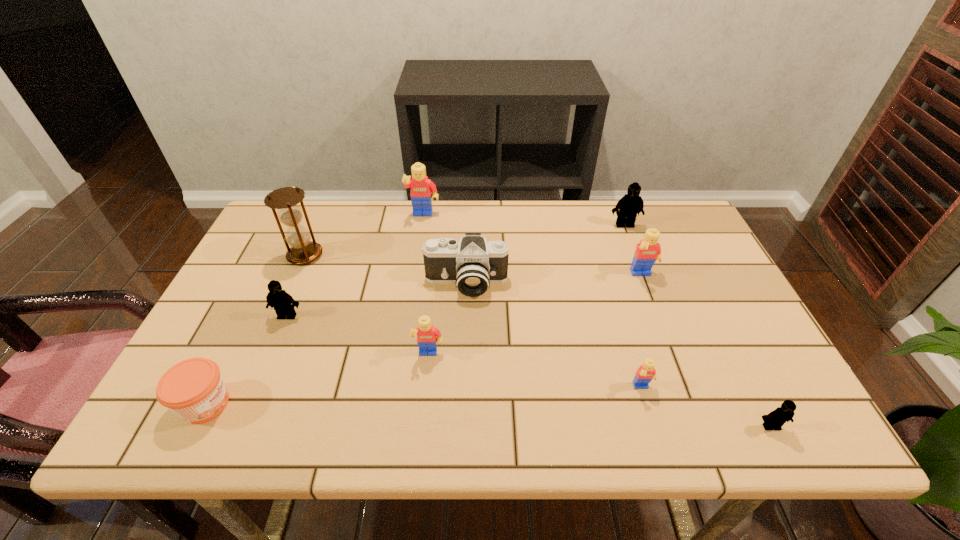
At what (x,y) coordinates should I click in order to perform the action: click on free space located on the face of the biggest black Lego. Please return your answer as a coordinate pair (x, y). Image resolution: width=960 pixels, height=540 pixels. Looking at the image, I should click on (652, 296).

Locate an element on the screen. The width and height of the screenshot is (960, 540). free space located 0.280m on the face of the third nearest yellow Lego is located at coordinates (679, 370).

Identify the location of vacant region located on the back of the camera. The height and width of the screenshot is (540, 960). (468, 219).

The width and height of the screenshot is (960, 540). Identify the location of free location located 0.210m on the face of the sixth farthest object. (254, 395).

This screenshot has width=960, height=540. What are the coordinates of `free space located 0.050m on the face of the second nearest yellow Lego` in the screenshot? It's located at (426, 383).

The width and height of the screenshot is (960, 540). What are the coordinates of `vacant point located 0.060m on the front label of the jam` in the screenshot? It's located at (261, 404).

The height and width of the screenshot is (540, 960). Find the location of `vacant region located on the face of the sixth farthest Lego`. vacant region located on the face of the sixth farthest Lego is located at coordinates (658, 440).

Locate an element on the screen. hourglass that is at the far edge is located at coordinates (302, 251).

Identify the location of jam at the near edge. (193, 389).

You are a GUI agent. You are given a task and a screenshot of the screen. Output one action in this format:
    pyautogui.click(x=<x>, y=<y>)
    Task: Click on the Lego located at the near edge
    This screenshot has height=540, width=960.
    Given the screenshot: What is the action you would take?
    pyautogui.click(x=776, y=419)